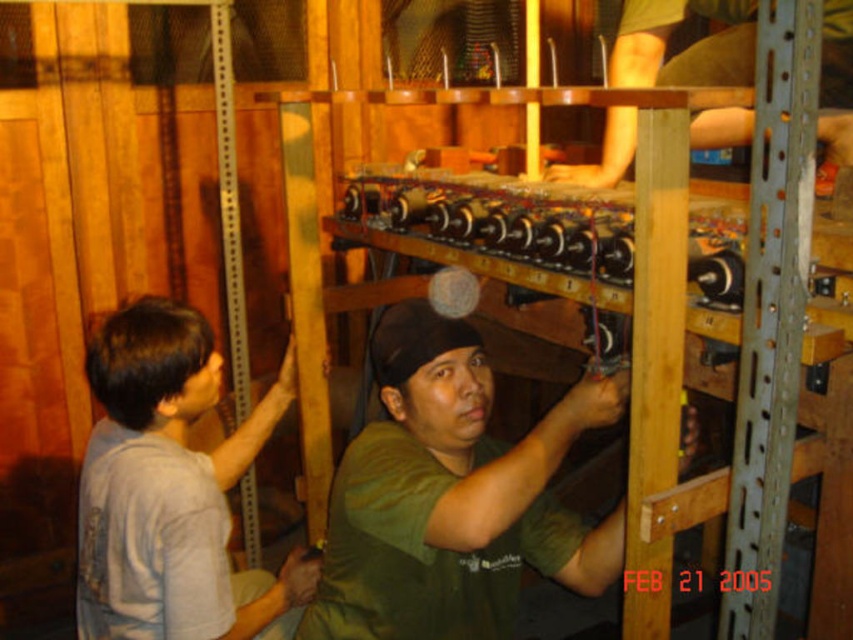
Which of these two, gray cotton shirt at left or green matte shirt at upper center, stands shorter?

With less height is green matte shirt at upper center.

Which is in front, point (163, 632) or point (722, 141)?

Point (163, 632) is in front.

Between point (102, 584) and point (664, 3), which one is positioned behind?

The point (664, 3) is more distant.

At what (x,y) coordinates should I click in order to perform the action: click on gray cotton shirt at left. Please return your answer as a coordinate pair (x, y). Image resolution: width=853 pixels, height=640 pixels. Looking at the image, I should click on (167, 486).

Is the position of green matte shirt at center less distant than that of gray cotton shirt at left?

Yes, it is.

Who is higher up, green matte shirt at center or gray cotton shirt at left?

green matte shirt at center is above.

Image resolution: width=853 pixels, height=640 pixels. What do you see at coordinates (451, 497) in the screenshot?
I see `green matte shirt at center` at bounding box center [451, 497].

Find the location of a particular element. Image resolution: width=853 pixels, height=640 pixels. green matte shirt at center is located at coordinates (451, 497).

The width and height of the screenshot is (853, 640). What do you see at coordinates (451, 497) in the screenshot?
I see `green matte shirt at center` at bounding box center [451, 497].

Where is `green matte shirt at center`? green matte shirt at center is located at coordinates (451, 497).

I want to click on green matte shirt at center, so click(451, 497).